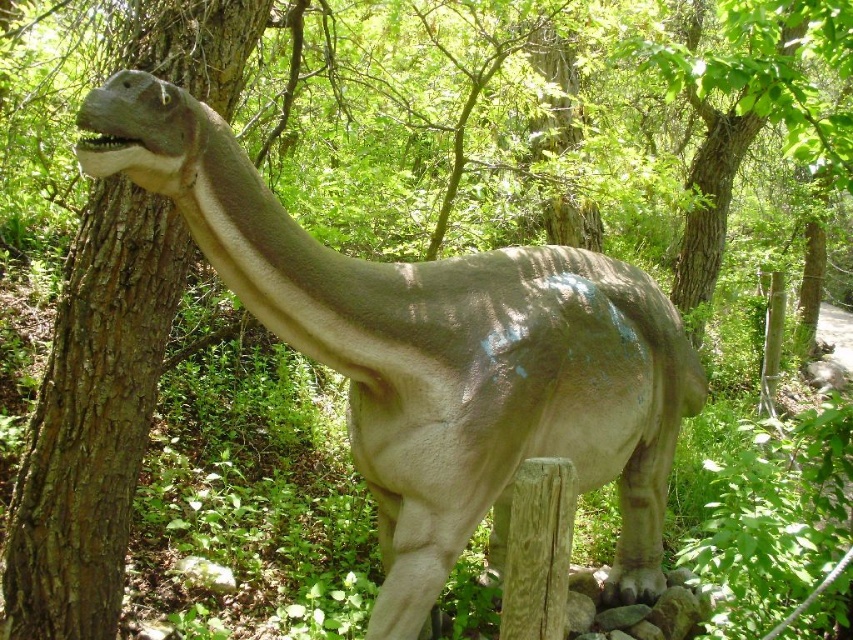
Consider the image. Is brown rough tree trunk at left to the left of green leafy tree at upper center from the viewer's perspective?

Yes, brown rough tree trunk at left is to the left of green leafy tree at upper center.

Is brown rough tree trunk at left bigger than green leafy tree at upper center?

Incorrect, brown rough tree trunk at left is not larger than green leafy tree at upper center.

Who is more forward, (x=125, y=536) or (x=735, y=154)?

Point (x=125, y=536) is more forward.

Where is `brown rough tree trunk at left`? The height and width of the screenshot is (640, 853). brown rough tree trunk at left is located at coordinates (93, 417).

Does smooth gray dinosaur at center come behind brown rough tree trunk at left?

No.

Does smooth gray dinosaur at center have a smaller size compared to brown rough tree trunk at left?

No, smooth gray dinosaur at center is not smaller than brown rough tree trunk at left.

Is point (618, 358) closer to viewer compared to point (126, 339)?

No.

This screenshot has width=853, height=640. I want to click on smooth gray dinosaur at center, so (x=433, y=353).

Who is positioned more to the left, smooth gray dinosaur at center or green leafy tree at upper center?

smooth gray dinosaur at center is more to the left.

Is smooth gray dinosaur at center taller than green leafy tree at upper center?

No.

What do you see at coordinates (433, 353) in the screenshot? The image size is (853, 640). I see `smooth gray dinosaur at center` at bounding box center [433, 353].

The image size is (853, 640). Identify the location of smooth gray dinosaur at center. (433, 353).